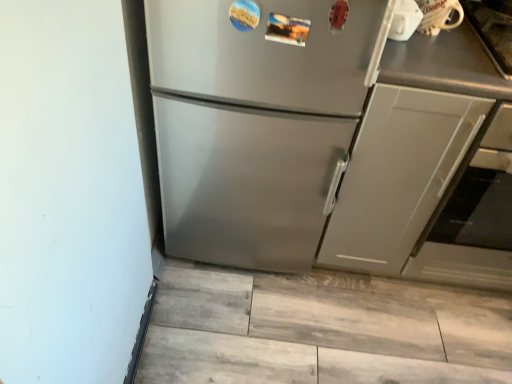
Question: From the image's perspective, would you say matte gray cabinet at right is shown under white glossy mug at upper right?

Choices:
 (A) no
 (B) yes

Answer: (B)

Question: Can white glossy mug at upper right be found inside matte gray cabinet at right?

Choices:
 (A) yes
 (B) no

Answer: (B)

Question: Can you confirm if matte gray cabinet at right is smaller than white glossy mug at upper right?

Choices:
 (A) yes
 (B) no

Answer: (B)

Question: Can you confirm if matte gray cabinet at right is bigger than white glossy mug at upper right?

Choices:
 (A) no
 (B) yes

Answer: (B)

Question: Are matte gray cabinet at right and white glossy mug at upper right far apart?

Choices:
 (A) no
 (B) yes

Answer: (A)

Question: Does matte gray cabinet at right have a lesser width compared to white glossy mug at upper right?

Choices:
 (A) no
 (B) yes

Answer: (A)

Question: Is white glossy mug at upper right wider than satin gray oven at right?

Choices:
 (A) yes
 (B) no

Answer: (B)

Question: Considering the relative positions of white glossy mug at upper right and satin gray oven at right in the image provided, is white glossy mug at upper right to the left of satin gray oven at right from the viewer's perspective?

Choices:
 (A) yes
 (B) no

Answer: (A)

Question: From the image's perspective, is white glossy mug at upper right on top of satin gray oven at right?

Choices:
 (A) no
 (B) yes

Answer: (B)

Question: Is the position of white glossy mug at upper right less distant than that of satin gray oven at right?

Choices:
 (A) yes
 (B) no

Answer: (B)

Question: Is white glossy mug at upper right outside of satin gray oven at right?

Choices:
 (A) yes
 (B) no

Answer: (A)

Question: Can you confirm if white glossy mug at upper right is thinner than satin gray oven at right?

Choices:
 (A) no
 (B) yes

Answer: (B)

Question: Is matte gray cabinet at right not within satin silver refrigerator at center?

Choices:
 (A) no
 (B) yes

Answer: (B)